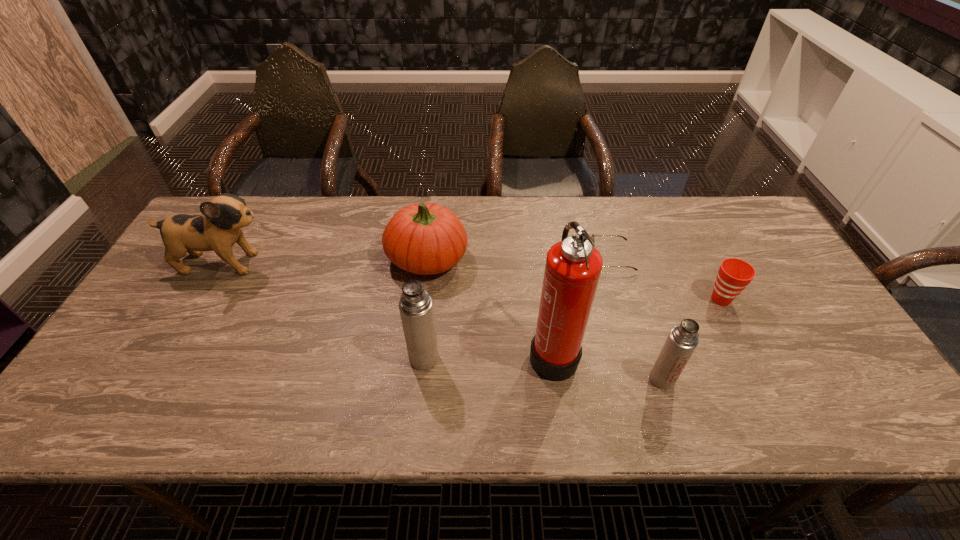
The height and width of the screenshot is (540, 960). Identify the location of sunglasses situated at the far edge. (592, 236).

I want to click on pumpkin situated at the far edge, so click(424, 238).

Where is `fire extinguisher situated at the near edge`? This screenshot has width=960, height=540. fire extinguisher situated at the near edge is located at coordinates (573, 266).

You are a GUI agent. You are given a task and a screenshot of the screen. Output one action in this format:
    pyautogui.click(x=<x>, y=<y>)
    Task: Click on the object that is at the left edge
    
    Given the screenshot: What is the action you would take?
    pyautogui.click(x=218, y=228)

The width and height of the screenshot is (960, 540). Identify the location of vacant point at the far edge. pyautogui.click(x=546, y=232).

The image size is (960, 540). In the image, there is a desktop. What are the coordinates of `free space at the near edge` in the screenshot? It's located at (267, 388).

Where is `vacant area at the left edge of the desktop`? This screenshot has width=960, height=540. vacant area at the left edge of the desktop is located at coordinates (160, 307).

Image resolution: width=960 pixels, height=540 pixels. In the image, there is a desktop. Find the location of `free space at the far left corner`. free space at the far left corner is located at coordinates (246, 235).

In the image, there is a desktop. Identify the location of vacant space at the near left corner. (128, 364).

This screenshot has height=540, width=960. I want to click on vacant space at the far right corner of the desktop, so click(x=703, y=200).